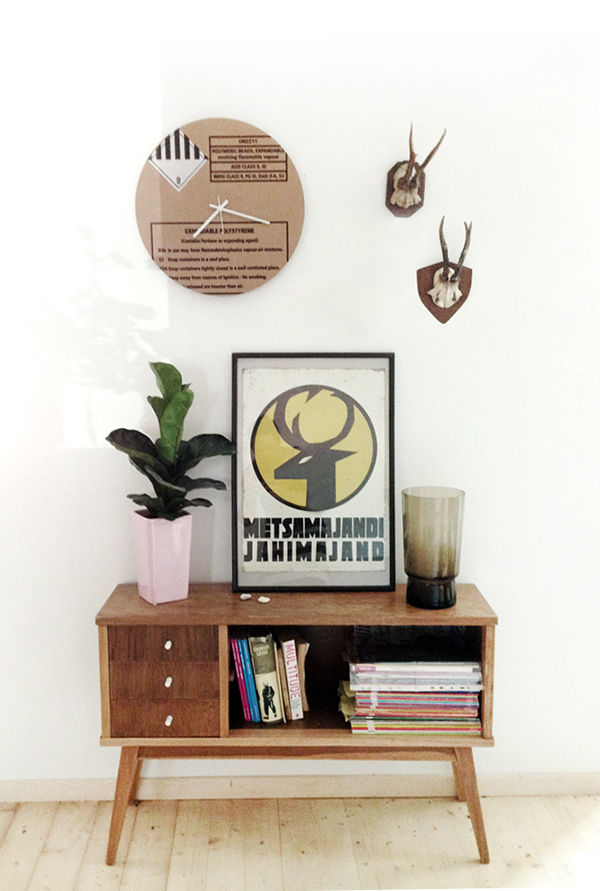
This screenshot has width=600, height=891. Identify the location of deer picture. (319, 468).